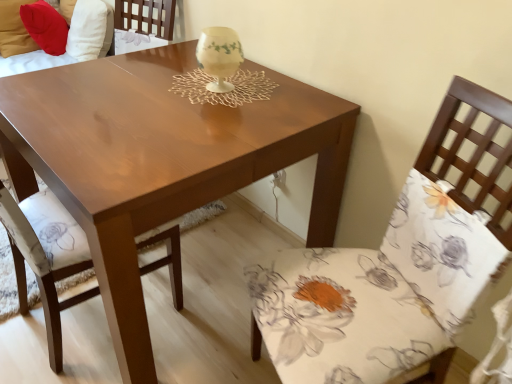
Question: Is matte brown couch at upper left, positioned as the 1th couch in left-to-right order, inside or outside of floral fabric chair at right, which is the second chair in left-to-right order?

Choices:
 (A) inside
 (B) outside

Answer: (B)

Question: From a real-world perspective, is matte brown couch at upper left, positioned as the 1th couch in left-to-right order, positioned above or below floral fabric chair at right, the 1th chair from the right?

Choices:
 (A) above
 (B) below

Answer: (A)

Question: Based on their relative distances, which object is nearer to the matte brown couch at upper left, positioned as the 1th couch in left-to-right order?

Choices:
 (A) shiny brown table at center
 (B) ivory porcelain candle holder at center
 (C) velvet red pillow at upper left, marked as the second couch in a left-to-right arrangement
 (D) matte wood chair at center, which is the 1th chair from left to right
 (E) floral fabric chair at right, the 1th chair from the right

Answer: (C)

Question: Which is nearer to the matte wood chair at center, which is the 1th chair from left to right?

Choices:
 (A) shiny brown table at center
 (B) floral fabric chair at right, which is the second chair in left-to-right order
 (C) matte brown couch at upper left, which appears as the 2th couch when viewed from the right
 (D) ivory porcelain candle holder at center
 (E) velvet red pillow at upper left, marked as the second couch in a left-to-right arrangement

Answer: (A)